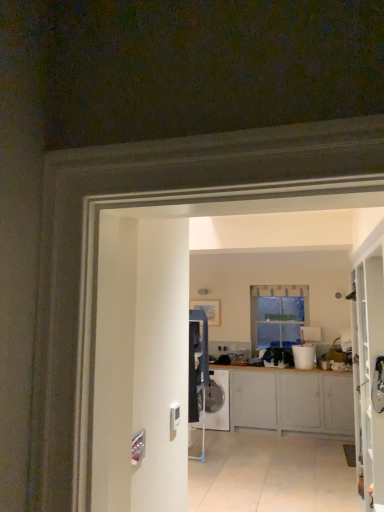
Question: Should I look upward or downward to see white glossy bucket at center?

Choices:
 (A) up
 (B) down

Answer: (B)

Question: From the image's perspective, does matte gray cabinets at center appear lower than white glossy bucket at center?

Choices:
 (A) yes
 (B) no

Answer: (A)

Question: Is matte gray cabinets at center behind white glossy bucket at center?

Choices:
 (A) no
 (B) yes

Answer: (A)

Question: Does matte gray cabinets at center appear on the left side of white glossy bucket at center?

Choices:
 (A) yes
 (B) no

Answer: (A)

Question: Is matte gray cabinets at center closer to camera compared to white glossy bucket at center?

Choices:
 (A) yes
 (B) no

Answer: (A)

Question: Is matte gray cabinets at center turned away from white glossy bucket at center?

Choices:
 (A) no
 (B) yes

Answer: (A)

Question: Is matte gray cabinets at center taller than white glossy bucket at center?

Choices:
 (A) no
 (B) yes

Answer: (B)

Question: Is white glossy washing machine at center positioned behind matte gray cabinets at center?

Choices:
 (A) yes
 (B) no

Answer: (A)

Question: Can you confirm if white glossy washing machine at center is taller than matte gray cabinets at center?

Choices:
 (A) no
 (B) yes

Answer: (A)

Question: Is white glossy washing machine at center smaller than matte gray cabinets at center?

Choices:
 (A) no
 (B) yes

Answer: (B)

Question: Are white glossy washing machine at center and matte gray cabinets at center beside each other?

Choices:
 (A) yes
 (B) no

Answer: (B)

Question: Can you confirm if white glossy washing machine at center is shorter than matte gray cabinets at center?

Choices:
 (A) no
 (B) yes

Answer: (B)

Question: Can you confirm if white glossy washing machine at center is thinner than matte gray cabinets at center?

Choices:
 (A) no
 (B) yes

Answer: (B)

Question: Considering the relative positions of clear glass window at center and white glossy bucket at center in the image provided, is clear glass window at center to the right of white glossy bucket at center from the viewer's perspective?

Choices:
 (A) yes
 (B) no

Answer: (B)